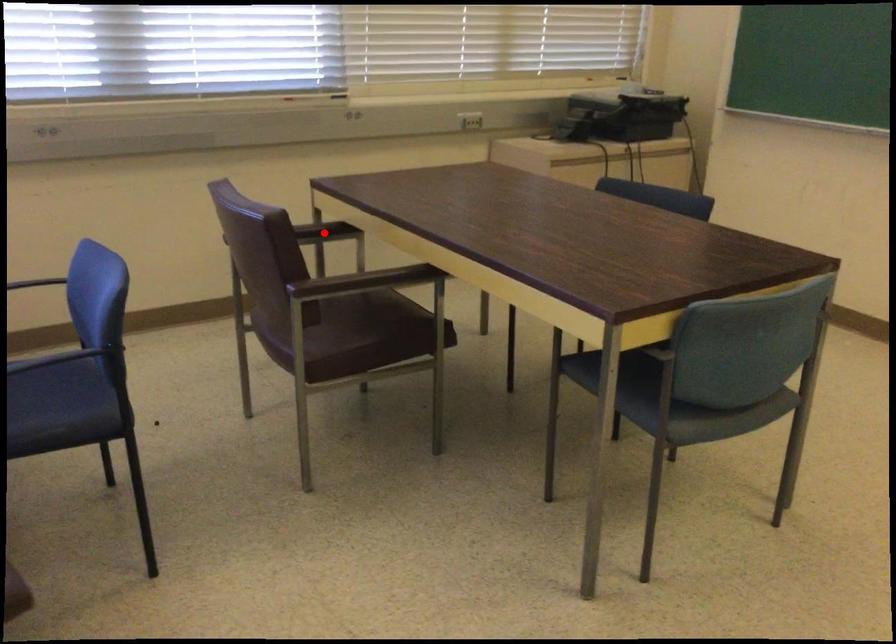
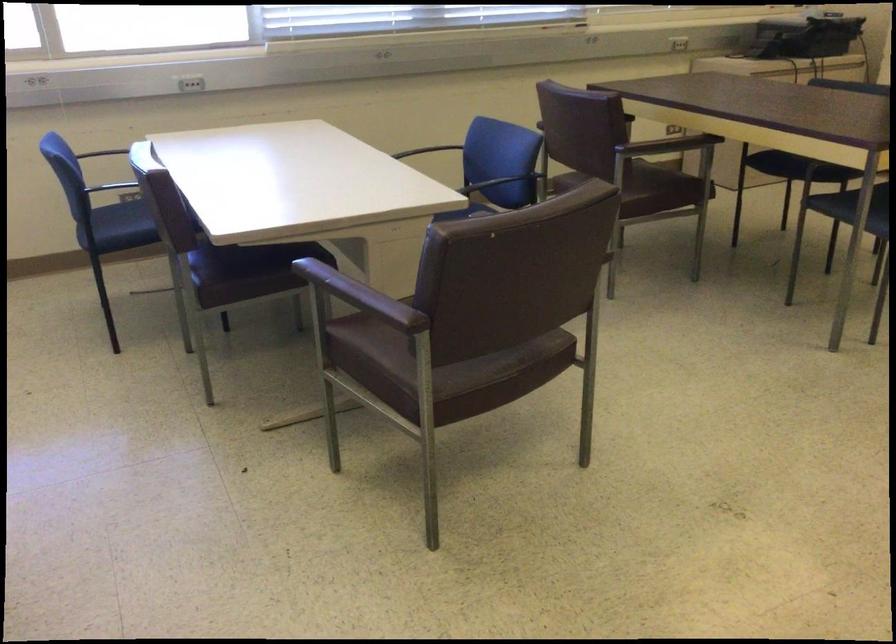
Question: I am providing you with two images of the same scene from different viewpoints. A red point is marked on the first image. Is the red point's position out of view in image 2?

Choices:
 (A) Yes
 (B) No

Answer: (A)